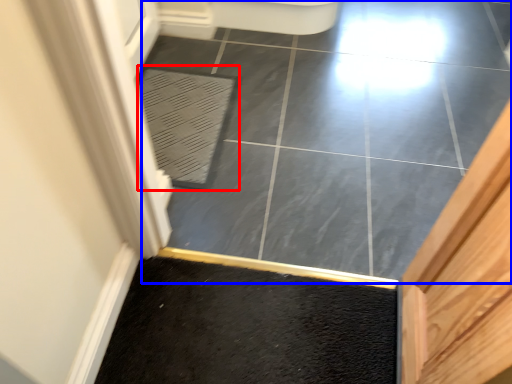
Question: Which object is closer to the camera taking this photo, bath mat (highlighted by a red box) or ceramic tile (highlighted by a blue box)?

Choices:
 (A) bath mat
 (B) ceramic tile

Answer: (B)